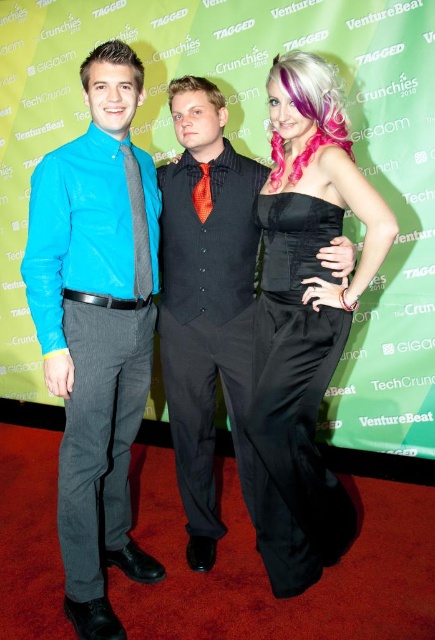
In order to click on shiny black vest at center in this screenshot , I will do `click(206, 300)`.

Can you confirm if shiny black vest at center is thinner than black satin dress at center?

Incorrect, shiny black vest at center's width is not less than black satin dress at center's.

You are a GUI agent. You are given a task and a screenshot of the screen. Output one action in this format:
    pyautogui.click(x=<x>, y=<y>)
    Task: Click on the shiny black vest at center
    
    Given the screenshot: What is the action you would take?
    pyautogui.click(x=206, y=300)

This screenshot has height=640, width=435. In order to click on shiny black vest at center in this screenshot , I will do `click(206, 300)`.

Describe the element at coordinates (97, 326) in the screenshot. I see `matte blue shirt at left` at that location.

Between matte blue shirt at left and shiny black vest at center, which one appears on the left side from the viewer's perspective?

Positioned to the left is matte blue shirt at left.

Is point (100, 212) positioned before point (208, 568)?

Yes, point (100, 212) is in front of point (208, 568).

This screenshot has width=435, height=640. In order to click on matte blue shirt at left in this screenshot , I will do `click(97, 326)`.

Between matte blue shirt at left and black satin dress at center, which one appears on the left side from the viewer's perspective?

Positioned to the left is matte blue shirt at left.

Who is higher up, matte blue shirt at left or black satin dress at center?

matte blue shirt at left

The image size is (435, 640). I want to click on matte blue shirt at left, so click(x=97, y=326).